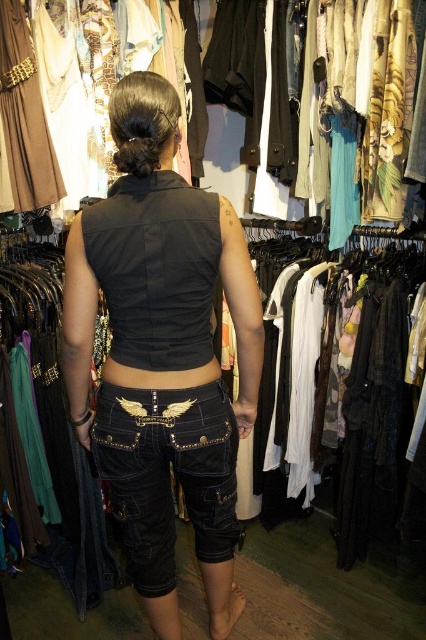
Is black denim shorts at center shorter than denim shorts at center?

No, black denim shorts at center is not shorter than denim shorts at center.

Does black denim shorts at center have a greater width compared to denim shorts at center?

Correct, the width of black denim shorts at center exceeds that of denim shorts at center.

The width and height of the screenshot is (426, 640). What do you see at coordinates (157, 262) in the screenshot?
I see `black denim shorts at center` at bounding box center [157, 262].

Where is `black denim shorts at center`? black denim shorts at center is located at coordinates (157, 262).

Is denim shorts at center thinner than black leather belt at center?

Incorrect, denim shorts at center's width is not less than black leather belt at center's.

Between denim shorts at center and black leather belt at center, which one has less height?

With less height is black leather belt at center.

Is point (111, 428) positioned in front of point (112, 378)?

That is True.

Locate an element on the screen. The height and width of the screenshot is (640, 426). denim shorts at center is located at coordinates (167, 474).

Who is lower down, white sheer fabric at center or black leather belt at center?

Positioned lower is white sheer fabric at center.

Does white sheer fabric at center have a lesser height compared to black leather belt at center?

Incorrect, white sheer fabric at center's height does not fall short of black leather belt at center's.

Identify the location of white sheer fabric at center. Image resolution: width=426 pixels, height=640 pixels. (367, 394).